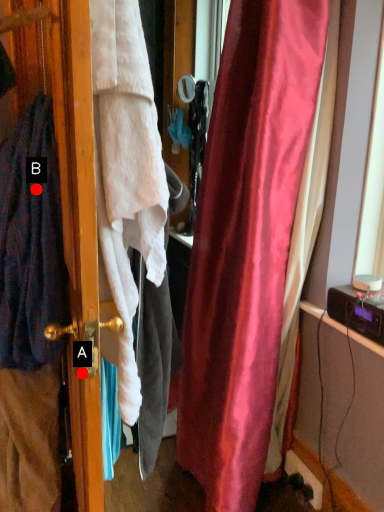
Question: Two points are circled on the image, labeled by A and B beside each circle. Which of the following is the farthest from the observer?

Choices:
 (A) A is further
 (B) B is further

Answer: (B)